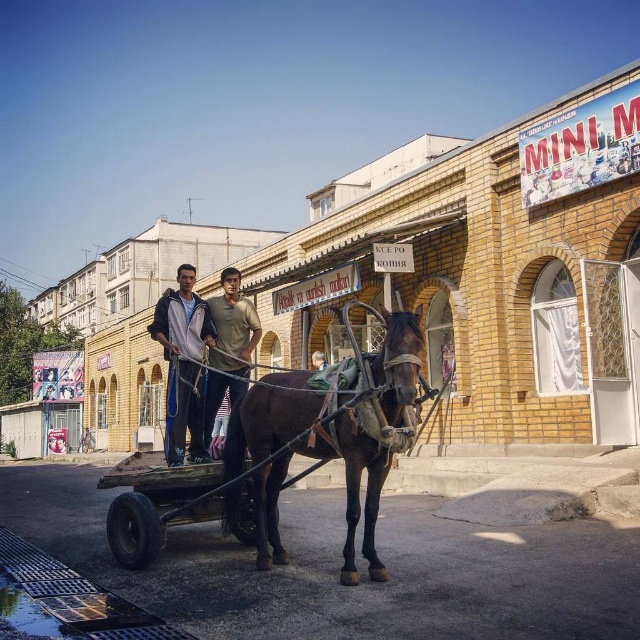
Based on the photo, is shiny brown horse at center bigger than light brown leather jacket at center?

Indeed, shiny brown horse at center has a larger size compared to light brown leather jacket at center.

Does point (337, 417) come closer to viewer compared to point (316, 355)?

Yes, it is in front of point (316, 355).

Identify the location of shiny brown horse at center. The width and height of the screenshot is (640, 640). (308, 456).

I want to click on shiny brown horse at center, so click(x=308, y=456).

Does light brown cotton shirt at center appear under light brown leather jacket at center?

Indeed, light brown cotton shirt at center is positioned under light brown leather jacket at center.

Between light brown cotton shirt at center and light brown leather jacket at center, which one is positioned lower?

Positioned lower is light brown cotton shirt at center.

Where is `light brown cotton shirt at center`? light brown cotton shirt at center is located at coordinates point(195,356).

Does shiny brown horse at center come in front of light brown cotton shirt at center?

Yes, shiny brown horse at center is closer to the viewer.

Is shiny brown horse at center smaller than light brown cotton shirt at center?

Correct, shiny brown horse at center occupies less space than light brown cotton shirt at center.

Which is in front, point (268, 381) or point (184, 348)?

Point (268, 381) is in front.

Where is `shiny brown horse at center`? This screenshot has height=640, width=640. shiny brown horse at center is located at coordinates (308, 456).